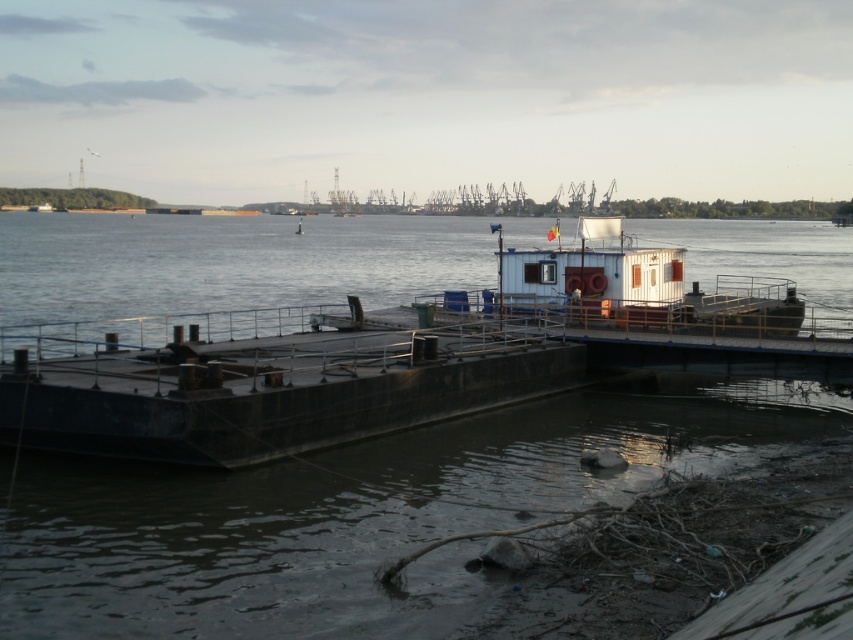
You are standing on the dock and looking at the brown concrete water at center and the dark gray concrete barge at center. Which object is nearer to you?

The brown concrete water at center is closer to the viewer than the dark gray concrete barge at center.

You are a delivery person who needs to transport a 100 feet long cargo container from the brown concrete water at center to the dark gray concrete barge at center. Can you safely move the container between them without it getting damaged?

The distance between the brown concrete water at center and the dark gray concrete barge at center is 76.35 feet. Since the cargo container is 100 feet long, it cannot fit within the available space, so moving it would risk damage.